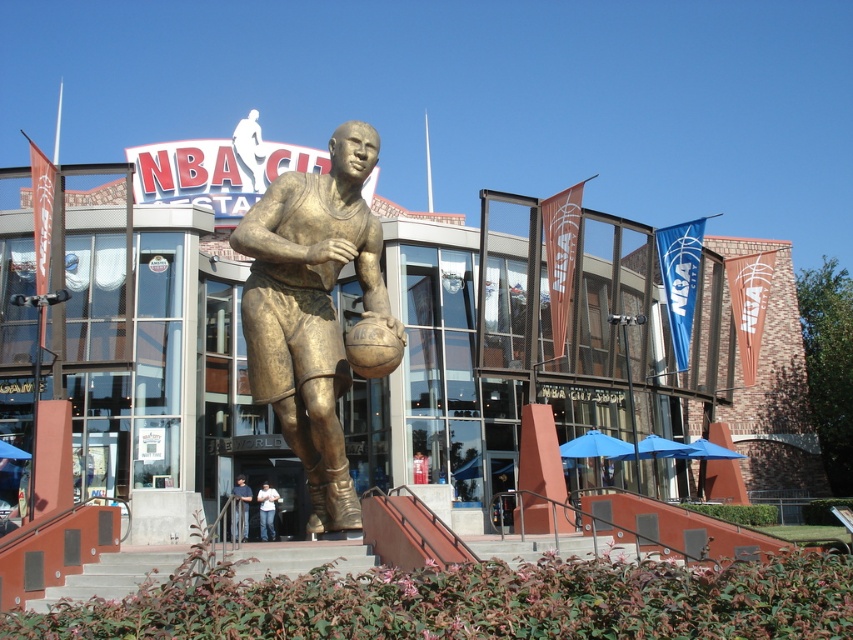
You are a photographer planning to take a photo of the gold statue at center and the light blue jeans at center for a magazine spread. The editor requires the statue to be the focal point. Based on the scene description, which object should you position closer to the camera to ensure the statue remains the focal point?

The gold statue at center has a larger size compared to light blue jeans at center, so positioning the gold statue at center closer to the camera will naturally draw attention to it, making it the focal point.

You are standing at the entrance of NBA City and want to take a photo of the gold statue at center and the light blue jeans at center. If your camera can focus on objects within 30 meters, will you be able to capture both clearly in one shot?

The gold statue at center is 36.22 meters away from the light blue jeans at center. Since the camera can only focus on objects within 30 meters, the distance between them exceeds the camera range, so you cannot capture both clearly in one shot.